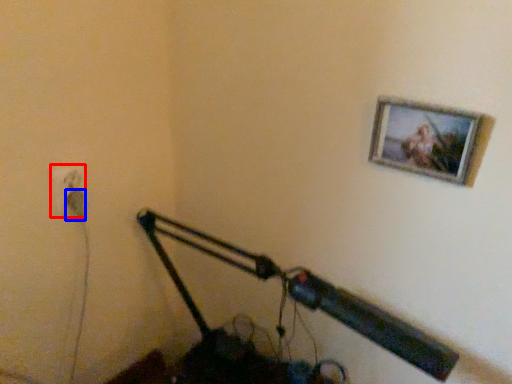
Question: Which object appears farthest to the camera in this image, electric outlet (highlighted by a red box) or plug (highlighted by a blue box)?

Choices:
 (A) electric outlet
 (B) plug

Answer: (B)